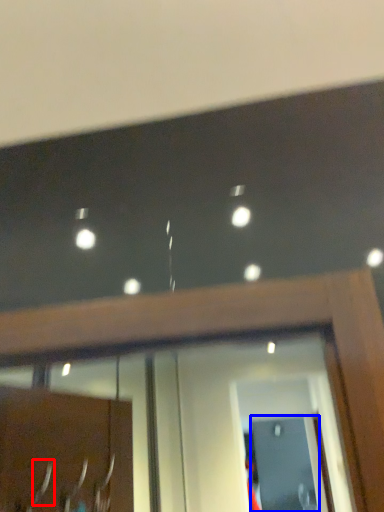
Question: Which of the following is the farthest to the observer, door handle (highlighted by a red box) or screen door (highlighted by a blue box)?

Choices:
 (A) door handle
 (B) screen door

Answer: (B)